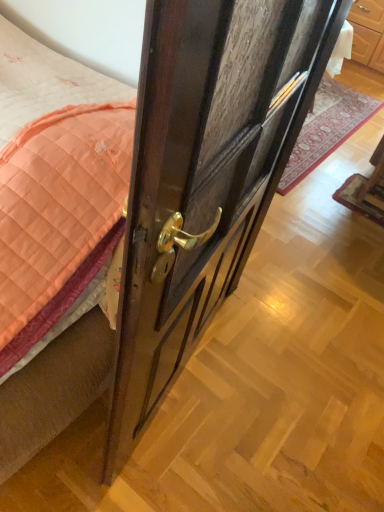
Question: Choose the correct answer: Is wooden chair at lower right inside dark wood door at center or outside it?

Choices:
 (A) inside
 (B) outside

Answer: (B)

Question: Considering their positions, is wooden chair at lower right located in front of or behind dark wood door at center?

Choices:
 (A) front
 (B) behind

Answer: (B)

Question: Estimate the real-world distances between objects in this image. Which object is farther from the wooden door handle at center?

Choices:
 (A) wooden chair at lower right
 (B) dark wood door at center

Answer: (B)

Question: Estimate the real-world distances between objects in this image. Which object is farther from the wooden chair at lower right?

Choices:
 (A) dark wood door at center
 (B) wooden door handle at center

Answer: (A)